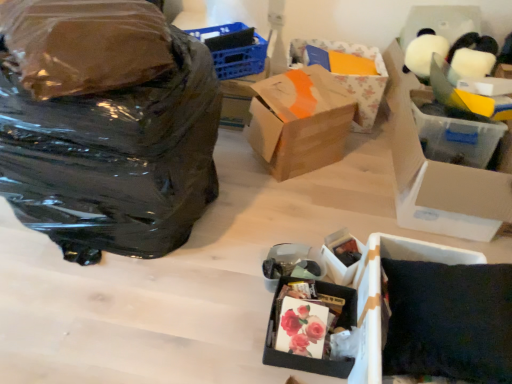
Question: Can you confirm if brown cardboard box at center, which ranks as the 2th box in top-to-bottom order, is shorter than dark fabric pillow at lower right?

Choices:
 (A) yes
 (B) no

Answer: (B)

Question: Is brown cardboard box at center, placed as the 4th box when sorted from bottom to top, wider than dark fabric pillow at lower right?

Choices:
 (A) yes
 (B) no

Answer: (B)

Question: From the image's perspective, does brown cardboard box at center, placed as the 4th box when sorted from bottom to top, appear higher than dark fabric pillow at lower right?

Choices:
 (A) no
 (B) yes

Answer: (B)

Question: Can you confirm if brown cardboard box at center, which ranks as the 2th box in top-to-bottom order, is bigger than dark fabric pillow at lower right?

Choices:
 (A) no
 (B) yes

Answer: (B)

Question: Can you confirm if brown cardboard box at center, which ranks as the 2th box in top-to-bottom order, is taller than dark fabric pillow at lower right?

Choices:
 (A) no
 (B) yes

Answer: (B)

Question: Considering the positions of point (449, 332) and point (348, 304), is point (449, 332) closer or farther from the camera than point (348, 304)?

Choices:
 (A) closer
 (B) farther

Answer: (A)

Question: Is dark fabric pillow at lower right in front of or behind matte black box at lower center, which appears as the first box when ordered from the bottom, in the image?

Choices:
 (A) behind
 (B) front

Answer: (B)

Question: Considering the positions of dark fabric pillow at lower right and matte black box at lower center, the 5th box when ordered from top to bottom, in the image, is dark fabric pillow at lower right taller or shorter than matte black box at lower center, the 5th box when ordered from top to bottom,?

Choices:
 (A) tall
 (B) short

Answer: (A)

Question: Is dark fabric pillow at lower right bigger or smaller than matte black box at lower center, which appears as the first box when ordered from the bottom?

Choices:
 (A) small
 (B) big

Answer: (B)

Question: Visually, is dark fabric pillow at lower right positioned to the left or to the right of black plastic bag at left?

Choices:
 (A) right
 (B) left

Answer: (A)

Question: Considering the positions of dark fabric pillow at lower right and black plastic bag at left in the image, is dark fabric pillow at lower right bigger or smaller than black plastic bag at left?

Choices:
 (A) big
 (B) small

Answer: (B)

Question: Considering the positions of point (442, 349) and point (38, 173), is point (442, 349) closer or farther from the camera than point (38, 173)?

Choices:
 (A) closer
 (B) farther

Answer: (A)

Question: From their relative heights in the image, would you say dark fabric pillow at lower right is taller or shorter than black plastic bag at left?

Choices:
 (A) tall
 (B) short

Answer: (B)

Question: Is blue plastic basket at upper center spatially inside brown cardboard box at center, which ranks as the 2th box in top-to-bottom order, or outside of it?

Choices:
 (A) inside
 (B) outside

Answer: (B)

Question: From the image's perspective, relative to brown cardboard box at center, placed as the 4th box when sorted from bottom to top, is blue plastic basket at upper center above or below?

Choices:
 (A) below
 (B) above

Answer: (B)